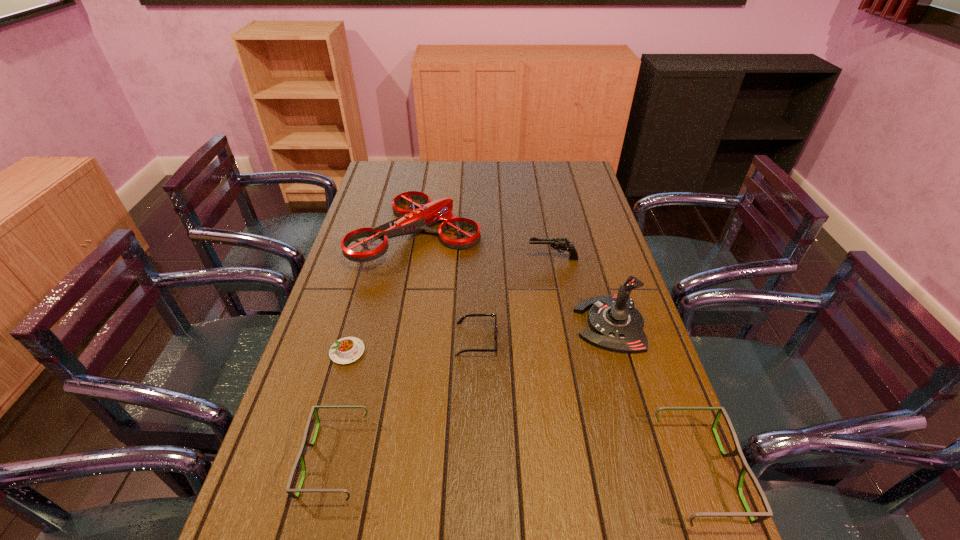
Locate an element on the screen. This screenshot has height=540, width=960. empty location between the right spectacles and the drone is located at coordinates (559, 353).

The image size is (960, 540). Find the location of `vacant area between the shortest object and the shorter spectacles`. vacant area between the shortest object and the shorter spectacles is located at coordinates (342, 406).

Choose which object is the fourth nearest neighbor to the shortest object. Please provide its 2D coordinates. Your answer should be formatted as a tuple, i.e. [(x, y)], where the tuple contains the x and y coordinates of a point satisfying the conditions above.

[(560, 244)]

This screenshot has width=960, height=540. Identify the location of the fourth closest object to the shortest object. (560, 244).